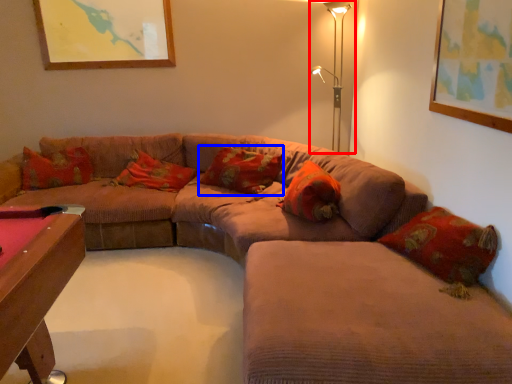
Question: Which object appears farthest to the camera in this image, table lamp (highlighted by a red box) or pillow (highlighted by a blue box)?

Choices:
 (A) table lamp
 (B) pillow

Answer: (A)